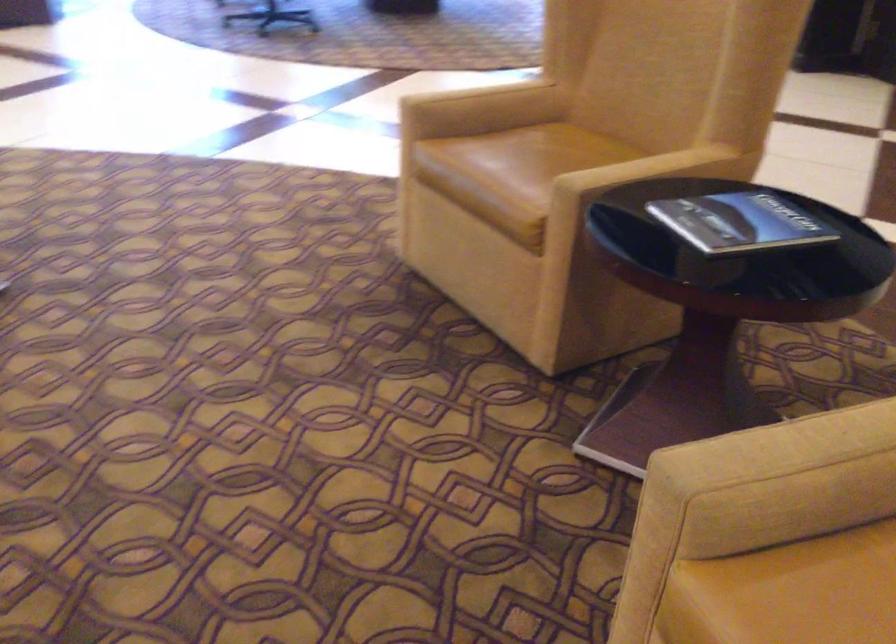
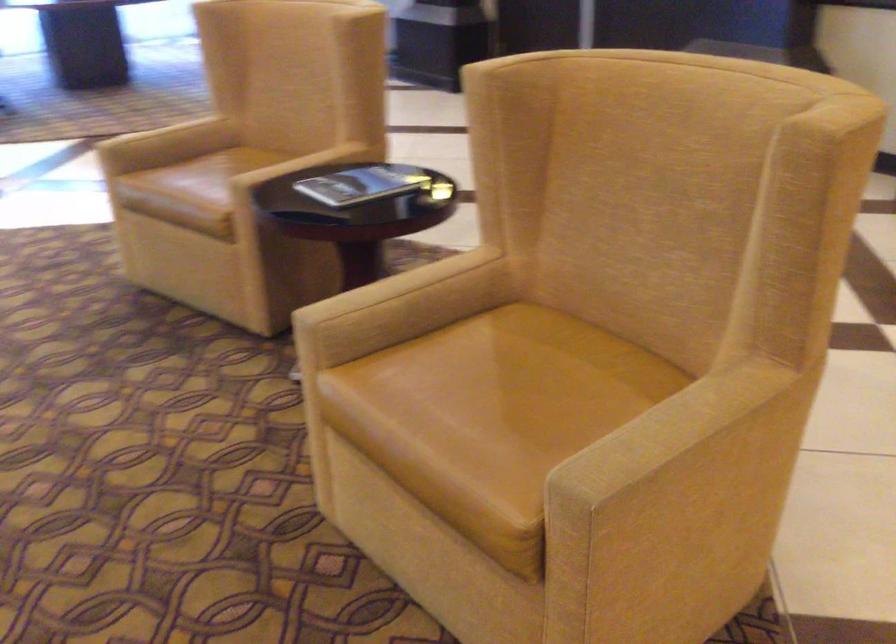
Question: The images are taken continuously from a first-person perspective. In which direction is your viewpoint rotating?

Choices:
 (A) Left
 (B) Right
 (C) Up
 (D) Down

Answer: (B)